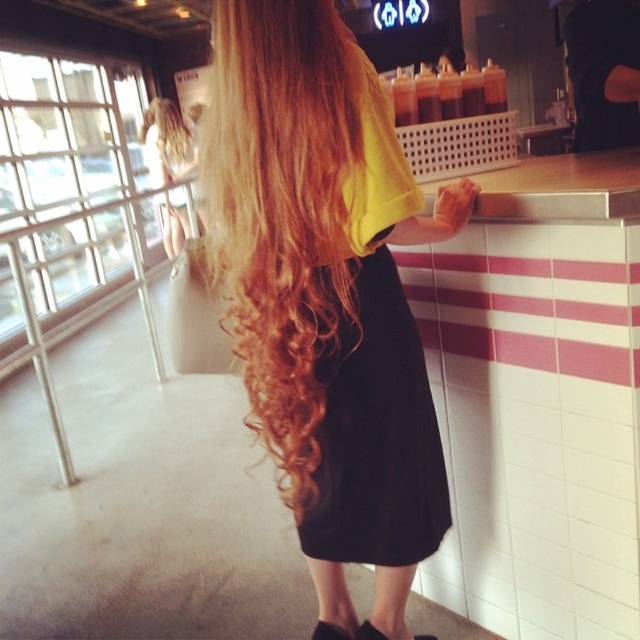
You are a customer at the diner and want to reach both the point at coordinates [186,227] and the point at coordinates [369,625] on the counter. Which point should you reach first to interact with the one closer to you?

You should reach the point at coordinates [186,227] first because it is closer to you than the point at coordinates [369,625].

In the scene shown: You are standing at the entrance of the diner and notice the black leather sandal at lower center. If you want to place a small tray exactly where the sandal is, what coordinates should you aim for?

The black leather sandal at lower center is located at point (332, 632), so you should aim for those coordinates to place the tray there.